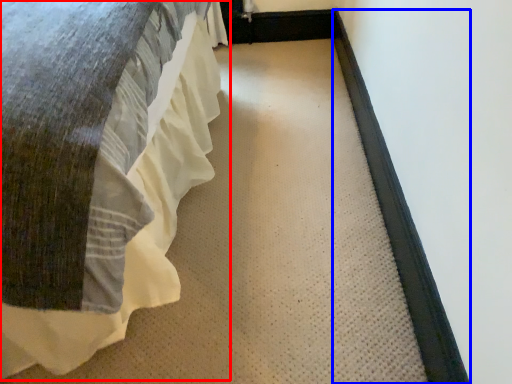
Question: Among these objects, which one is nearest to the camera, bed (highlighted by a red box) or doormat (highlighted by a blue box)?

Choices:
 (A) bed
 (B) doormat

Answer: (A)